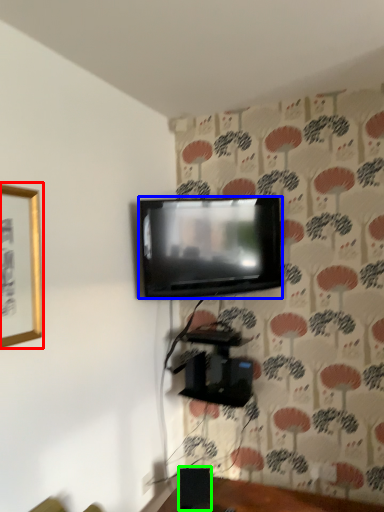
Question: Which object is positioned closest to picture frame (highlighted by a red box)? Select from television (highlighted by a blue box) and speaker (highlighted by a green box).

Choices:
 (A) television
 (B) speaker

Answer: (A)